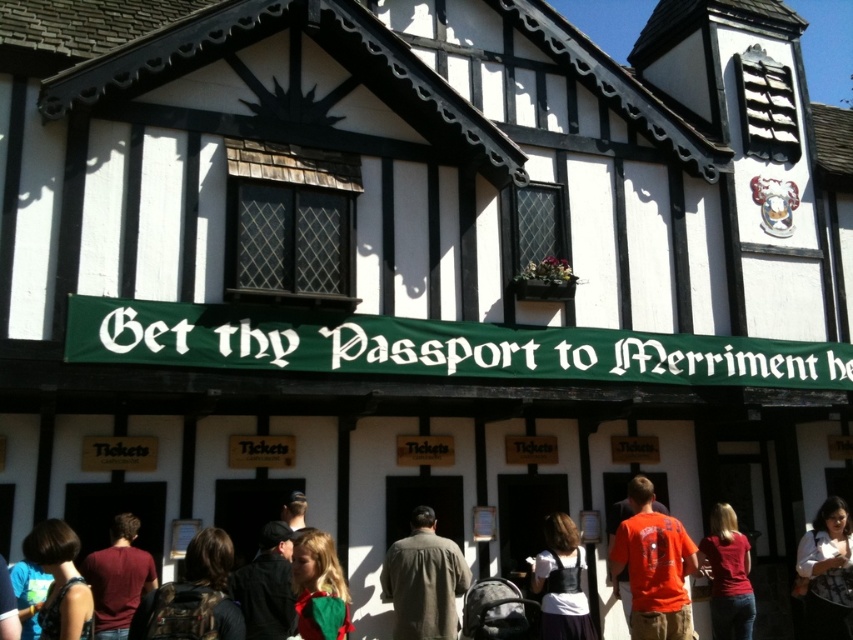
Question: Which point is closer to the camera?

Choices:
 (A) (648, 513)
 (B) (405, 584)

Answer: (B)

Question: Is matte red shirt at lower right above dark brown leather hat at lower center?

Choices:
 (A) yes
 (B) no

Answer: (B)

Question: Is black leather jacket at center wider than dark brown leather backpack at lower left?

Choices:
 (A) yes
 (B) no

Answer: (B)

Question: Can you confirm if matte maroon shirt at center is positioned below matte red shirt at lower right?

Choices:
 (A) no
 (B) yes

Answer: (A)

Question: Based on their relative distances, which object is farther from the white textured shirt at lower right?

Choices:
 (A) dark brown leather hat at lower center
 (B) brown textured coat at center
 (C) matte red shirt at lower right
 (D) green knitted sweater at center

Answer: (A)

Question: Among these points, which one is nearest to the camera?

Choices:
 (A) pos(653,605)
 (B) pos(297,525)
 (C) pos(248,618)

Answer: (C)